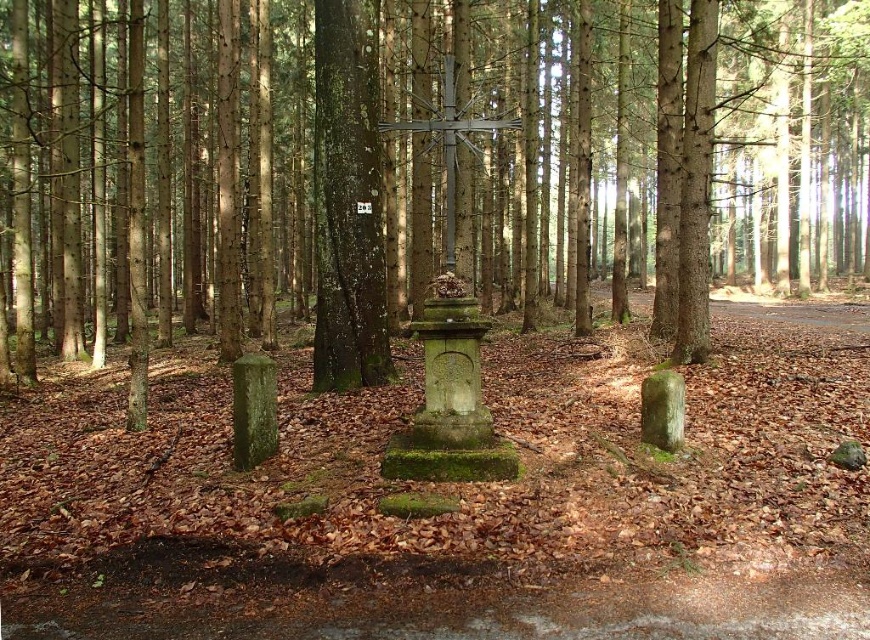
You are a hiker who has stumbled upon this forest scene. You notice the green mossy stone cross at center and the green mossy tree trunk at center. Which object is located higher up in the image?

The green mossy stone cross at center is positioned over the green mossy tree trunk at center, so it is higher up in the image.